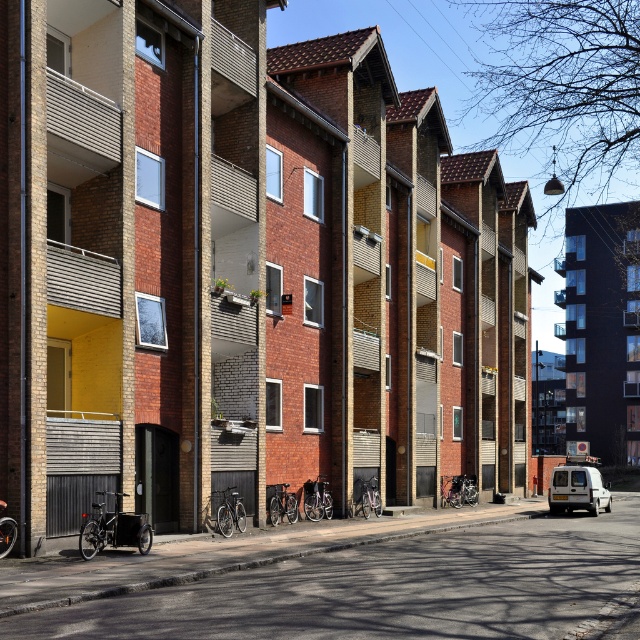
Does black metal bicycles at lower left appear on the left side of white matte van at lower right?

Indeed, black metal bicycles at lower left is positioned on the left side of white matte van at lower right.

Which is more to the right, black metal bicycles at lower left or white matte van at lower right?

white matte van at lower right

Is point (552, 612) positioned behind point (588, 493)?

No, it is in front of (588, 493).

The height and width of the screenshot is (640, 640). Find the location of `black metal bicycles at lower left`. black metal bicycles at lower left is located at coordinates (396, 589).